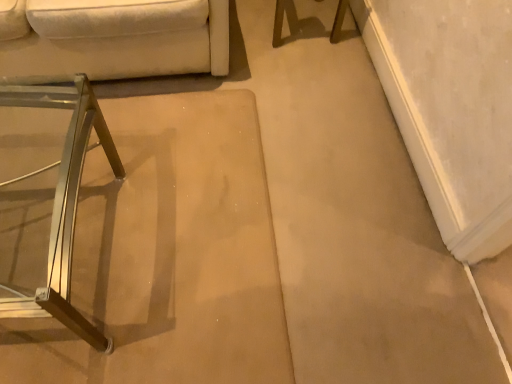
Describe the element at coordinates (63, 200) in the screenshot. I see `metallic glass table at left` at that location.

I want to click on metallic glass table at left, so click(x=63, y=200).

Find the location of a particular element. The height and width of the screenshot is (384, 512). metallic glass table at left is located at coordinates (63, 200).